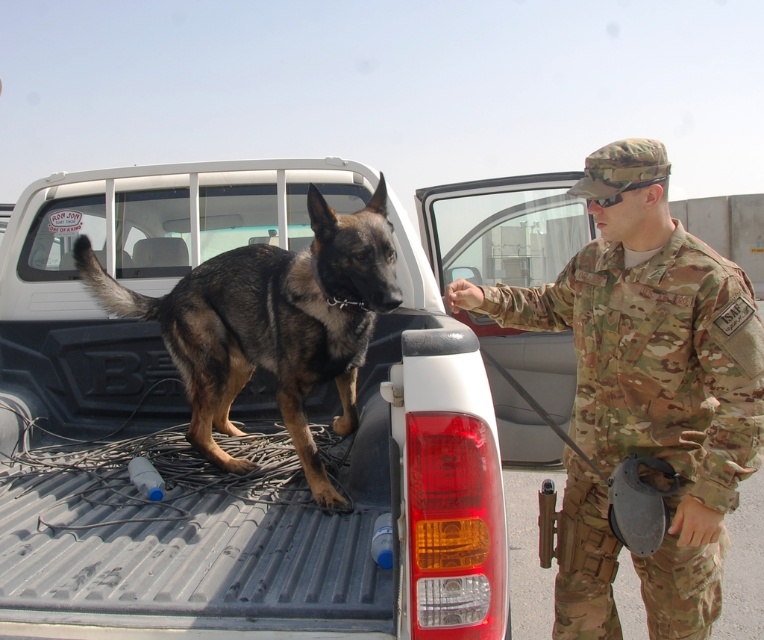
Where is the camouflage uniform at center located in the image?

The camouflage uniform at center is located at point [654,368].

You are a drone operator trying to drop a package at a specific location marked by point (643, 148). The drone can only drop packages within 5 feet of the camera. Can you safely drop the package at that point?

The distance of point (643, 148) from camera is 6.25 feet, which is beyond the drone package drop limit of 5 feet. The package cannot be safely dropped there.

You are a photographer trying to capture a group photo of the camouflage uniform at center and the brown fur dog at center. If you want to ensure both subjects are fully visible in the frame, which subject should you position closer to the camera to avoid cropping?

You should position the camouflage uniform at center closer to the camera because it has a lesser width compared to the brown fur dog at center, making it easier to fit within the frame without cropping.